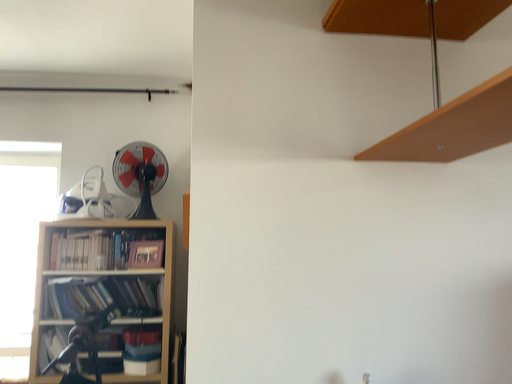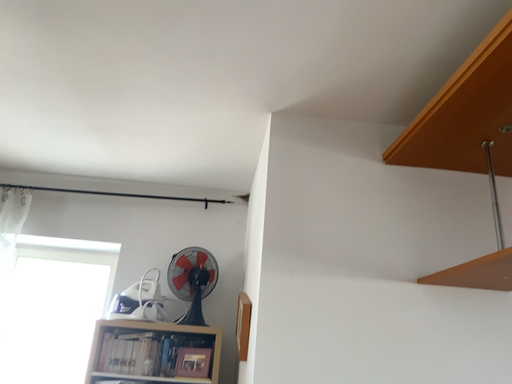
Question: How did the camera likely rotate when shooting the video?

Choices:
 (A) rotated upward
 (B) rotated downward

Answer: (A)